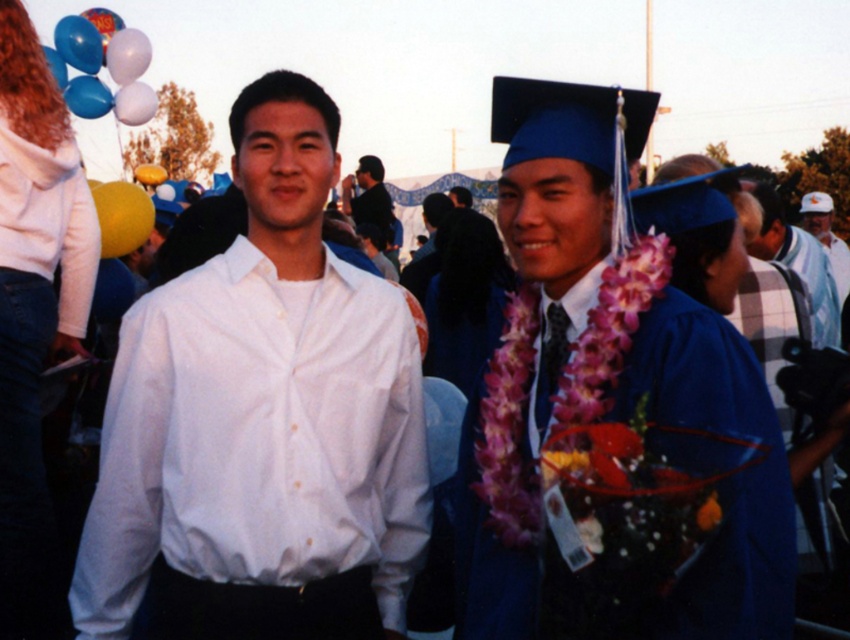
Is dark blue fabric jacket at center above white matte cap at upper center?

Correct, dark blue fabric jacket at center is located above white matte cap at upper center.

Between dark blue fabric jacket at center and white matte cap at upper center, which one is positioned lower?

white matte cap at upper center is lower down.

Measure the distance between point (x=354, y=198) and camera.

15.62 meters

Where is `dark blue fabric jacket at center`? This screenshot has height=640, width=850. dark blue fabric jacket at center is located at coordinates (367, 196).

The height and width of the screenshot is (640, 850). I want to click on blue matte graduation gown at center, so click(x=740, y=477).

Is point (726, 573) positioned after point (98, 256)?

No, (726, 573) is in front of (98, 256).

Identify the location of blue matte graduation gown at center. This screenshot has height=640, width=850. coord(740,477).

How much distance is there between blue matte graduation gown at center and dark blue fabric jacket at center?

14.53 meters

The width and height of the screenshot is (850, 640). Find the location of `blue matte graduation gown at center`. blue matte graduation gown at center is located at coordinates (740, 477).

Locate an element on the screen. This screenshot has width=850, height=640. blue matte graduation gown at center is located at coordinates (740, 477).